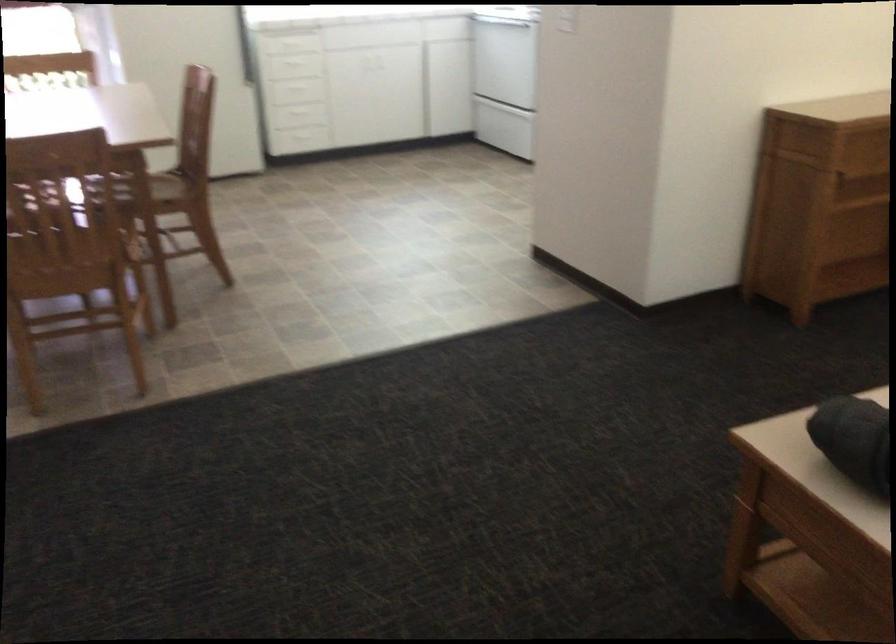
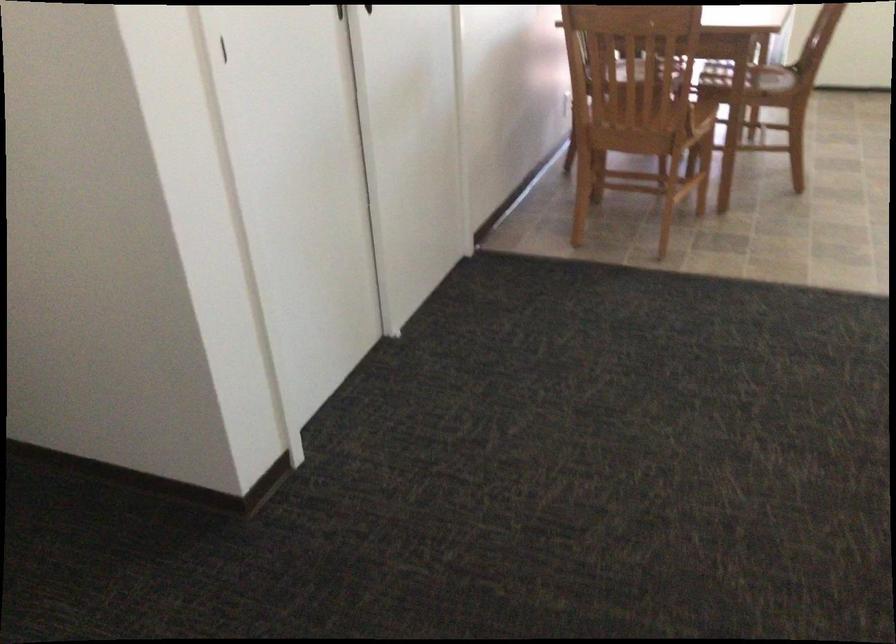
The point at (73, 270) is marked in the first image. Where is the corresponding point in the second image?

(645, 127)